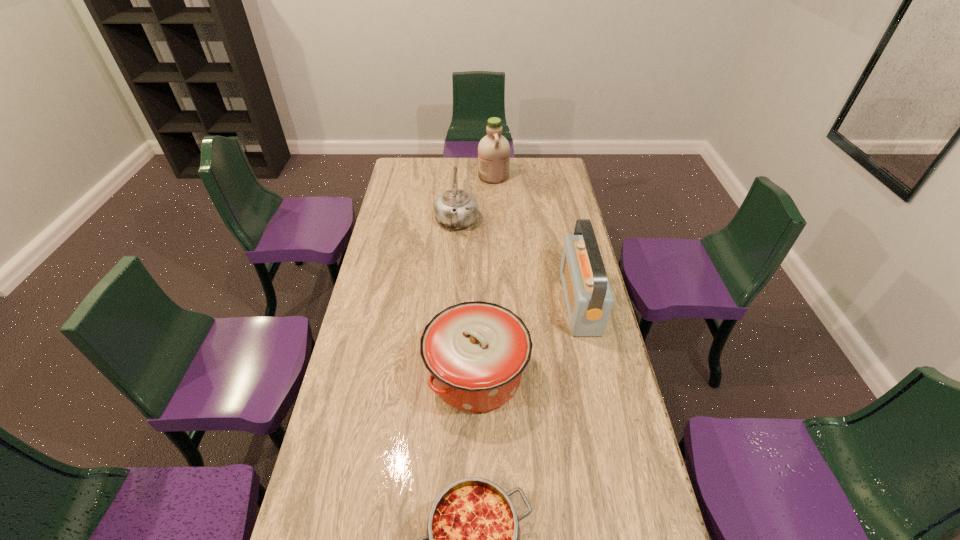
The height and width of the screenshot is (540, 960). What are the coordinates of `vacant region located 0.090m at the spout of the fourth nearest object` in the screenshot? It's located at (454, 253).

The image size is (960, 540). Find the location of `vacant point located 0.270m on the right of the farther casserole`. vacant point located 0.270m on the right of the farther casserole is located at coordinates (612, 374).

Identify the location of object that is at the far edge. This screenshot has height=540, width=960. (493, 150).

Where is `object located in the right edge section of the desktop`? This screenshot has height=540, width=960. object located in the right edge section of the desktop is located at coordinates pyautogui.click(x=588, y=296).

Locate an element on the screen. This screenshot has width=960, height=540. vacant region at the far edge is located at coordinates (525, 167).

At what (x,y) coordinates should I click in order to perform the action: click on vacant space at the left edge. Please return your answer as a coordinate pair (x, y). The image size is (960, 540). Looking at the image, I should click on (337, 418).

This screenshot has height=540, width=960. I want to click on vacant area at the right edge of the desktop, so click(x=570, y=342).

You are a GUI agent. You are given a task and a screenshot of the screen. Output one action in this format:
    pyautogui.click(x=<x>, y=<y>)
    Task: Click on the vacant point located between the kettle and the rightmost object
    The image size is (960, 540).
    Given the screenshot: What is the action you would take?
    pyautogui.click(x=518, y=262)

Identify the location of empty location between the taller casserole and the kettle. The width and height of the screenshot is (960, 540). (467, 299).

Where is `vacant area that lies between the kettle and the radio receiver`? vacant area that lies between the kettle and the radio receiver is located at coordinates (518, 262).